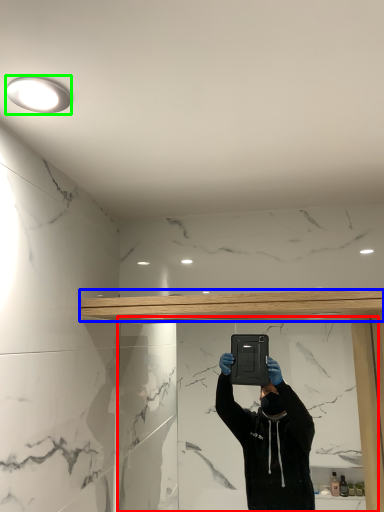
Question: Based on their relative distances, which object is farther from mirror (highlighted by a red box)? Choose from beam (highlighted by a blue box) and light fixture (highlighted by a green box).

Choices:
 (A) beam
 (B) light fixture

Answer: (B)